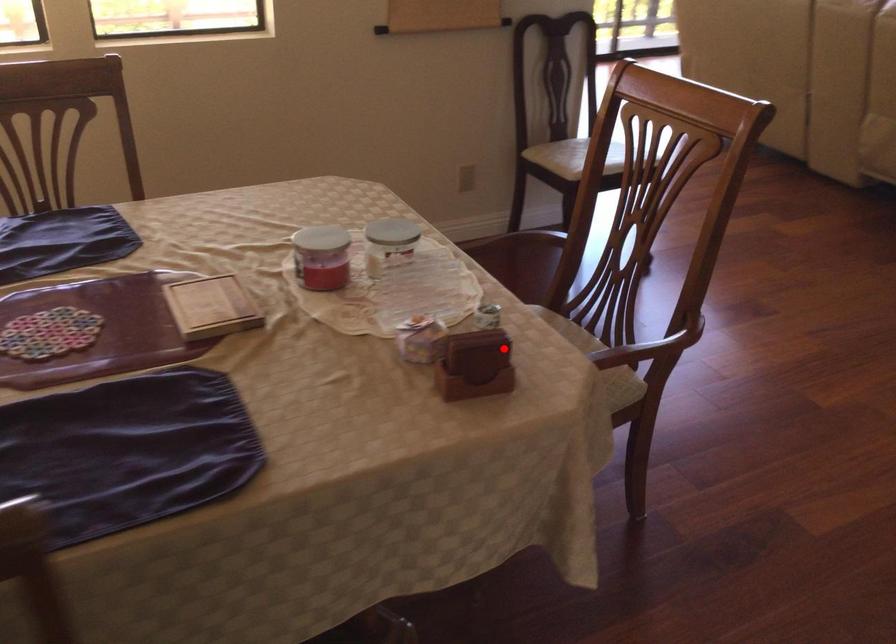
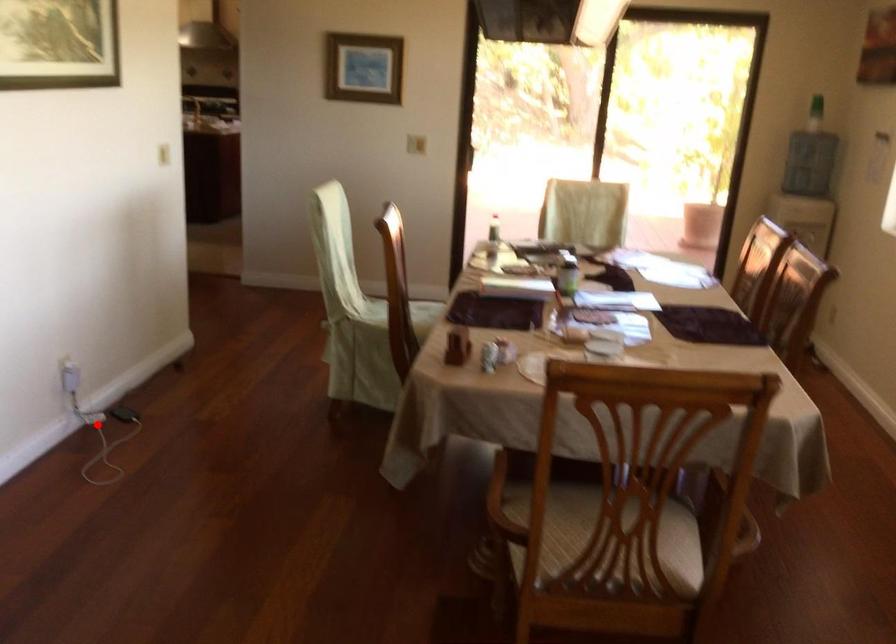
I am providing you with two images of the same scene from different viewpoints. A red point is marked on the first image and another point is marked on the second image. Do the highlighted points in image1 and image2 indicate the same real-world spot?

No